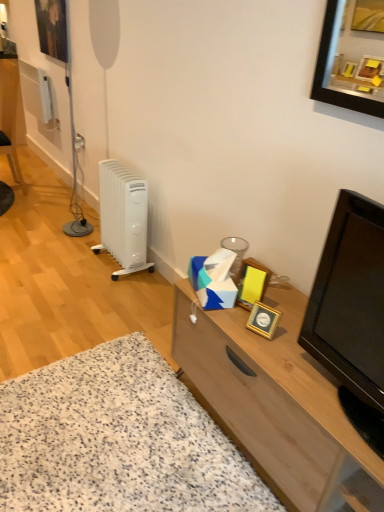
The height and width of the screenshot is (512, 384). What do you see at coordinates (252, 283) in the screenshot? I see `gold metallic picture frame at center-right, the second picture frame from the back` at bounding box center [252, 283].

Describe the element at coordinates (52, 28) in the screenshot. I see `matte black picture frame at upper left, the 1th picture frame when ordered from top to bottom` at that location.

What is the approximate width of black glossy television at right?

The width of black glossy television at right is 9.69 inches.

What do you see at coordinates (277, 404) in the screenshot? This screenshot has height=512, width=384. I see `wooden cabinet at center` at bounding box center [277, 404].

Identify the location of wooden cabinet at center. (277, 404).

Where is `white plastic radiator at left`? white plastic radiator at left is located at coordinates (123, 217).

You are a GUI agent. You are given a task and a screenshot of the screen. Output one action in this format:
    pyautogui.click(x=<x>, y=<y>)
    Task: Click on the wooden cabinet at lower right
    
    Given the screenshot: What is the action you would take?
    pyautogui.click(x=117, y=439)

Looking at this image, considering the sizes of objects white plastic radiator at left and matte black picture frame at upper left, acting as the third picture frame starting from the front, in the image provided, who is wider, white plastic radiator at left or matte black picture frame at upper left, acting as the third picture frame starting from the front,?

white plastic radiator at left.

Could you measure the distance between white plastic radiator at left and matte black picture frame at upper left, which is counted as the 3th picture frame, starting from the bottom?

white plastic radiator at left is 1.36 meters from matte black picture frame at upper left, which is counted as the 3th picture frame, starting from the bottom.

From the image's perspective, would you say white plastic radiator at left is positioned over matte black picture frame at upper left, which is counted as the 3th picture frame, starting from the bottom?

No, from the image's perspective, white plastic radiator at left is not above matte black picture frame at upper left, which is counted as the 3th picture frame, starting from the bottom.

Is white plastic radiator at left beside matte black picture frame at upper left, the first picture frame when ordered from back to front?

No, white plastic radiator at left is not beside matte black picture frame at upper left, the first picture frame when ordered from back to front.

From a real-world perspective, is black glossy television at right beneath gold metallic picture frame at center-right, the second picture frame when ordered from right to left?

No, from a real-world perspective, black glossy television at right is not under gold metallic picture frame at center-right, the second picture frame when ordered from right to left.

Would you say black glossy television at right is inside or outside gold metallic picture frame at center-right, the second picture frame in the left-to-right sequence?

black glossy television at right is outside gold metallic picture frame at center-right, the second picture frame in the left-to-right sequence.

Which is less distant, (321, 290) or (242, 277)?

Point (321, 290) is closer to the camera than point (242, 277).

Could you tell me if black glossy television at right is facing gold metallic picture frame at center-right, the second picture frame in the left-to-right sequence?

No, black glossy television at right is not facing towards gold metallic picture frame at center-right, the second picture frame in the left-to-right sequence.

Considering the sizes of wooden cabinet at center and wooden cabinet at lower right in the image, is wooden cabinet at center wider or thinner than wooden cabinet at lower right?

In the image, wooden cabinet at center appears to be more narrow than wooden cabinet at lower right.

This screenshot has height=512, width=384. Identify the location of cabinetry that appears above the wooden cabinet at lower right (from the image's perspective). [277, 404].

Considering the sizes of wooden cabinet at center and wooden cabinet at lower right in the image, is wooden cabinet at center taller or shorter than wooden cabinet at lower right?

Considering their sizes, wooden cabinet at center has more height than wooden cabinet at lower right.

Consider the image. Is wooden cabinet at center in front of wooden cabinet at lower right?

Yes, the depth of wooden cabinet at center is less than that of wooden cabinet at lower right.

In the image, there is a wooden cabinet at lower right. Where is `television above it (from the image's perspective)`? television above it (from the image's perspective) is located at coordinates (352, 313).

Would you say black glossy television at right is inside or outside wooden cabinet at lower right?

black glossy television at right lies outside wooden cabinet at lower right.

Are black glossy television at right and wooden cabinet at lower right located far from each other?

black glossy television at right is actually quite close to wooden cabinet at lower right.

Can you confirm if black glossy television at right is thinner than wooden cabinet at lower right?

Yes.

Which of these two, wooden cabinet at lower right or white plastic radiator at left, stands taller?

white plastic radiator at left.

From the image's perspective, relative to white plastic radiator at left, is wooden cabinet at lower right above or below?

From the image's perspective, wooden cabinet at lower right appears below white plastic radiator at left.

Which is in front, point (50, 471) or point (6, 78)?

Point (50, 471)

Considering the sizes of objects gold metallic picture frame at center-right, which ranks as the 1th picture frame in bottom-to-top order, and wooden cabinet at lower right in the image provided, who is smaller, gold metallic picture frame at center-right, which ranks as the 1th picture frame in bottom-to-top order, or wooden cabinet at lower right?

gold metallic picture frame at center-right, which ranks as the 1th picture frame in bottom-to-top order.

Could you measure the distance between gold metallic picture frame at center-right, arranged as the third picture frame when viewed from the left, and wooden cabinet at lower right?

gold metallic picture frame at center-right, arranged as the third picture frame when viewed from the left, is 27.98 inches from wooden cabinet at lower right.

Is gold metallic picture frame at center-right, the 1th picture frame viewed from the right, aimed at wooden cabinet at lower right?

No.

From a real-world perspective, who is located lower, gold metallic picture frame at center-right, the 1th picture frame viewed from the right, or wooden cabinet at lower right?

wooden cabinet at lower right is physically lower.

Is gold metallic picture frame at center-right, the second picture frame from the back, at the back of matte black picture frame at upper left, acting as the third picture frame starting from the front?

No, gold metallic picture frame at center-right, the second picture frame from the back, is not at the back of matte black picture frame at upper left, acting as the third picture frame starting from the front.

At what (x,y) coordinates should I click in order to perform the action: click on picture frame located on the left of gold metallic picture frame at center-right, the second picture frame when ordered from bottom to top. Please return your answer as a coordinate pair (x, y). Looking at the image, I should click on (52, 28).

From the image's perspective, which one is positioned higher, matte black picture frame at upper left, the first picture frame when ordered from back to front, or gold metallic picture frame at center-right, the 2th picture frame when ordered from top to bottom?

matte black picture frame at upper left, the first picture frame when ordered from back to front, appears higher in the image.

Is matte black picture frame at upper left, which is counted as the 3th picture frame, starting from the bottom, bigger than gold metallic picture frame at center-right, the second picture frame viewed from the front?

Correct, matte black picture frame at upper left, which is counted as the 3th picture frame, starting from the bottom, is larger in size than gold metallic picture frame at center-right, the second picture frame viewed from the front.

Image resolution: width=384 pixels, height=512 pixels. I want to click on picture frame above the white plastic radiator at left (from the image's perspective), so click(x=52, y=28).

The height and width of the screenshot is (512, 384). Find the location of `television above the gold metallic picture frame at center-right, the second picture frame when ordered from right to left (from a real-world perspective)`. television above the gold metallic picture frame at center-right, the second picture frame when ordered from right to left (from a real-world perspective) is located at coordinates click(352, 313).

Estimate the real-world distances between objects in this image. Which object is further from wooden cabinet at lower right, gold metallic picture frame at center-right, the second picture frame in the left-to-right sequence, or gold metallic picture frame at center-right, which ranks as the 1th picture frame in bottom-to-top order?

gold metallic picture frame at center-right, the second picture frame in the left-to-right sequence, is further to wooden cabinet at lower right.

Based on their spatial positions, is gold metallic picture frame at center-right, the 2th picture frame when ordered from top to bottom, or wooden cabinet at center closer to white plastic radiator at left?

The object closer to white plastic radiator at left is gold metallic picture frame at center-right, the 2th picture frame when ordered from top to bottom.

When comparing their distances from matte black picture frame at upper left, acting as the third picture frame starting from the front, does gold metallic picture frame at center-right, which ranks as the 3th picture frame in top-to-bottom order, or black glossy television at right seem further?

black glossy television at right is positioned further to the anchor matte black picture frame at upper left, acting as the third picture frame starting from the front.

Considering their positions, is matte black picture frame at upper left, the 1th picture frame when ordered from top to bottom, positioned further to gold metallic picture frame at center-right, marked as the third picture frame in a back-to-front arrangement, than wooden cabinet at lower right?

Among the two, matte black picture frame at upper left, the 1th picture frame when ordered from top to bottom, is located further to gold metallic picture frame at center-right, marked as the third picture frame in a back-to-front arrangement.

Considering their positions, is matte black picture frame at upper left, marked as the 1th picture frame in a left-to-right arrangement, positioned further to black glossy television at right than wooden cabinet at center?

matte black picture frame at upper left, marked as the 1th picture frame in a left-to-right arrangement.

In the scene shown: Based on their spatial positions, is gold metallic picture frame at center-right, which ranks as the 1th picture frame in bottom-to-top order, or wooden cabinet at lower right further from black glossy television at right?

wooden cabinet at lower right is positioned further to the anchor black glossy television at right.

Based on their spatial positions, is black glossy television at right or wooden cabinet at lower right closer to wooden cabinet at center?

Based on the image, black glossy television at right appears to be nearer to wooden cabinet at center.

Based on their spatial positions, is wooden cabinet at center or gold metallic picture frame at center-right, arranged as the third picture frame when viewed from the left, further from white plastic radiator at left?

Among the two, gold metallic picture frame at center-right, arranged as the third picture frame when viewed from the left, is located further to white plastic radiator at left.

Where is `cabinetry between black glossy television at right and gold metallic picture frame at center-right, which ranks as the 3th picture frame in top-to-bottom order, from front to back`? cabinetry between black glossy television at right and gold metallic picture frame at center-right, which ranks as the 3th picture frame in top-to-bottom order, from front to back is located at coordinates [x=277, y=404].

Where is `desk between matte black picture frame at upper left, which is counted as the 3th picture frame, starting from the bottom, and white plastic radiator at left, in the vertical direction`? This screenshot has height=512, width=384. desk between matte black picture frame at upper left, which is counted as the 3th picture frame, starting from the bottom, and white plastic radiator at left, in the vertical direction is located at coordinates (10, 117).

Locate an element on the screen. The image size is (384, 512). cabinetry between matte black picture frame at upper left, the 1th picture frame when ordered from top to bottom, and wooden cabinet at lower right, in the vertical direction is located at coordinates (277, 404).

Locate an element on the screen. This screenshot has width=384, height=512. television between matte black picture frame at upper left, the first picture frame when ordered from back to front, and wooden cabinet at lower right, in the vertical direction is located at coordinates (352, 313).